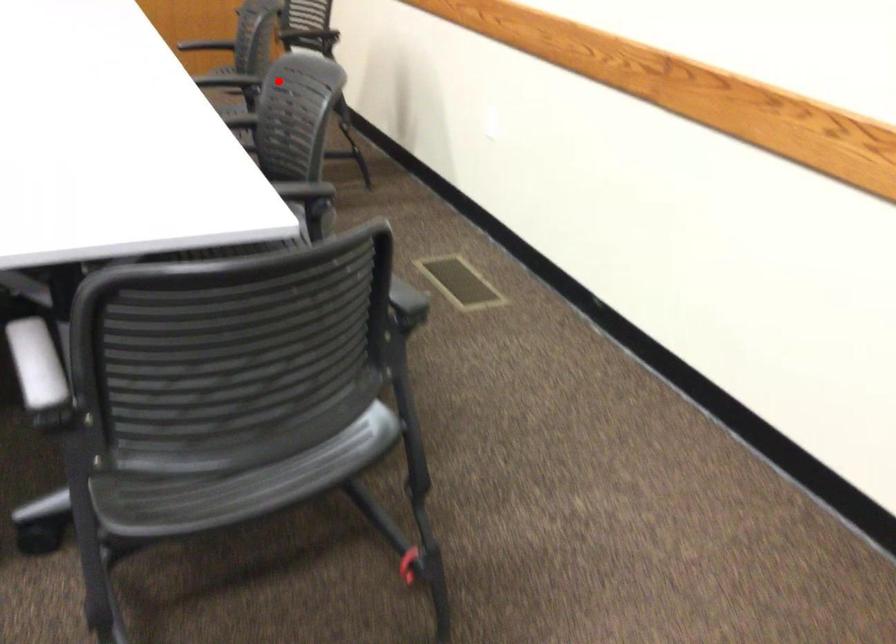
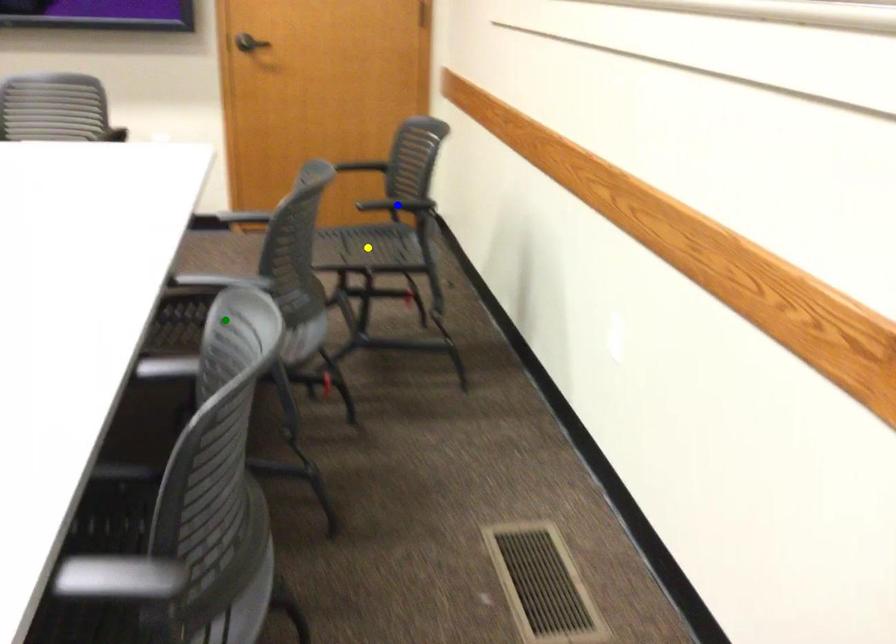
Question: I am providing you with two images of the same scene from different viewpoints. A red point is marked on the first image. You are given multiple points on the second image. Which spot in image 2 lines up with the point in image 1?

Choices:
 (A) yellow point
 (B) green point
 (C) blue point

Answer: (B)